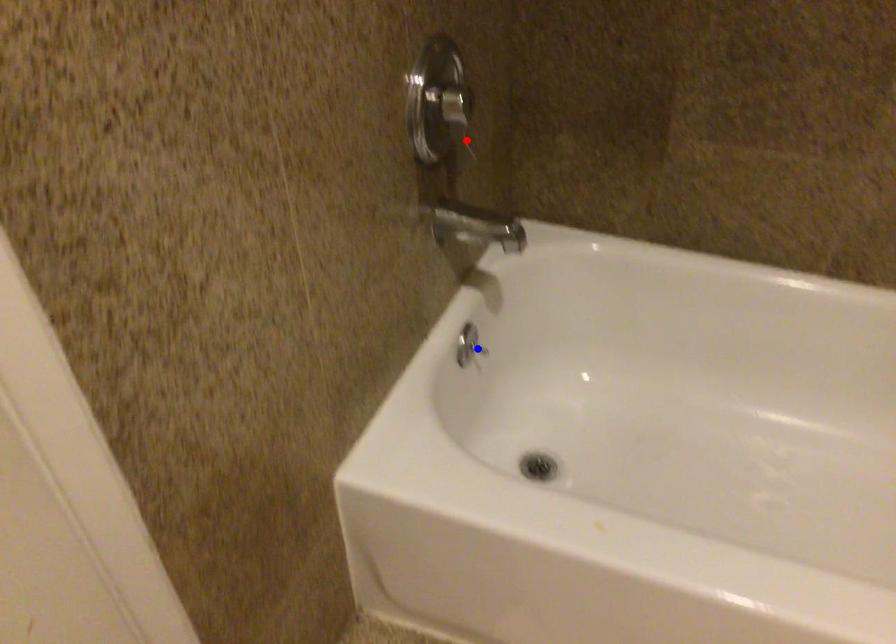
Question: Which of the two points in the image is closer to the camera?

Choices:
 (A) Blue point is closer.
 (B) Red point is closer.

Answer: (B)